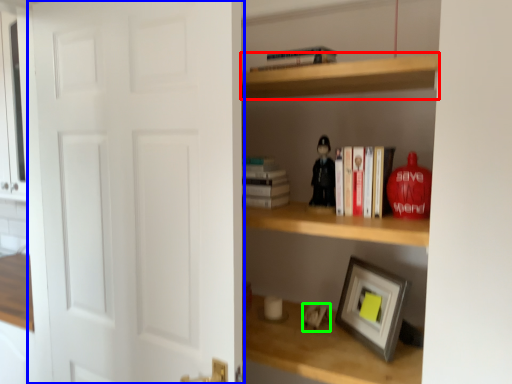
Question: Estimate the real-world distances between objects in this image. Which object is closer to cabinet (highlighted by a red box), door (highlighted by a blue box) or toy (highlighted by a green box)?

Choices:
 (A) door
 (B) toy

Answer: (A)